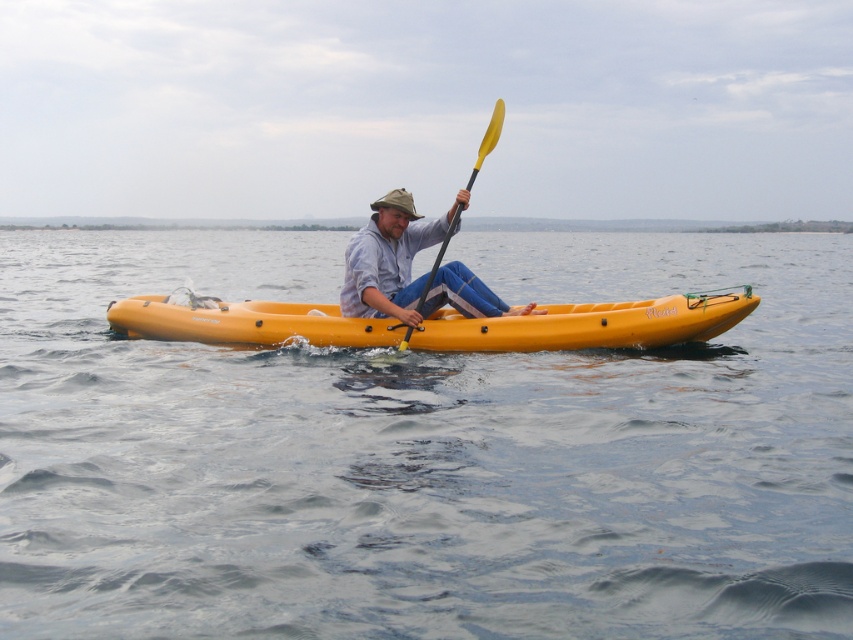
You are a photographer trying to capture the kayaker from above. Considering the yellow matte kayak at center and the matte blue jeans at center, which object would appear taller in the photo?

The matte blue jeans at center are taller than the yellow matte kayak at center, so they would appear taller in the photo.

You are a photographer aiming to capture the entire yellow matte kayak at center and the transparent water at center in one shot. Given that your camera has a fixed focal length, which object should you focus on first to ensure both are in frame?

The transparent water at center is bigger than the yellow matte kayak at center, so you should focus on the transparent water at center first to ensure both are fully captured in the frame.